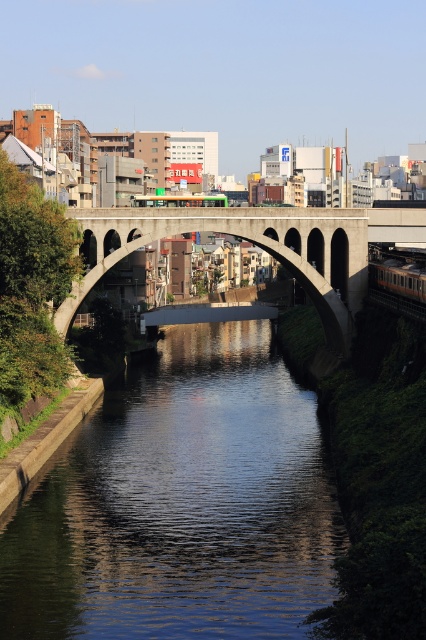
Question: Which point is farther to the camera?

Choices:
 (A) tap(74, 298)
 (B) tap(158, 196)

Answer: (B)

Question: Which object is closer to the camera taking this photo?

Choices:
 (A) concrete bridge at center
 (B) smooth concrete river at center
 (C) metallic silver train at center

Answer: (B)

Question: Is smooth concrete river at center positioned in front of concrete bridge at center?

Choices:
 (A) no
 (B) yes

Answer: (B)

Question: Does smooth concrete river at center appear over metallic silver train at center?

Choices:
 (A) yes
 (B) no

Answer: (B)

Question: Can you confirm if smooth concrete river at center is positioned above metallic silver train at center?

Choices:
 (A) yes
 (B) no

Answer: (B)

Question: Among these points, which one is nearest to the camera?

Choices:
 (A) (170, 202)
 (B) (316, 596)

Answer: (B)